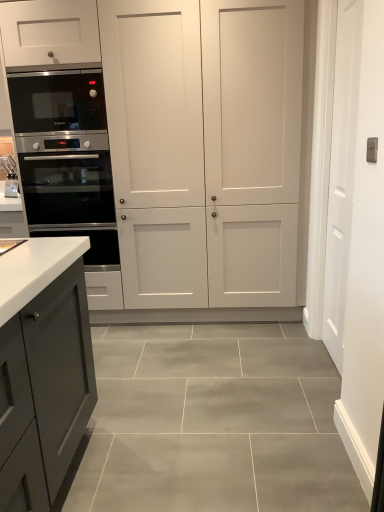
Question: From a real-world perspective, is white matte cabinet at center positioned over white glossy sink at left based on gravity?

Choices:
 (A) no
 (B) yes

Answer: (B)

Question: Is white matte cabinet at center taller than white glossy sink at left?

Choices:
 (A) no
 (B) yes

Answer: (B)

Question: Considering the relative sizes of white matte cabinet at center and white glossy sink at left in the image provided, is white matte cabinet at center shorter than white glossy sink at left?

Choices:
 (A) no
 (B) yes

Answer: (A)

Question: Can you confirm if white matte cabinet at center is thinner than white glossy sink at left?

Choices:
 (A) yes
 (B) no

Answer: (B)

Question: From a real-world perspective, is white matte cabinet at center beneath white glossy sink at left?

Choices:
 (A) no
 (B) yes

Answer: (A)

Question: Considering the positions of stainless steel oven at left and white glossy sink at left in the image, is stainless steel oven at left taller or shorter than white glossy sink at left?

Choices:
 (A) tall
 (B) short

Answer: (A)

Question: From a real-world perspective, is stainless steel oven at left positioned above or below white glossy sink at left?

Choices:
 (A) below
 (B) above

Answer: (A)

Question: Is stainless steel oven at left situated inside white glossy sink at left or outside?

Choices:
 (A) outside
 (B) inside

Answer: (A)

Question: Is stainless steel oven at left wider or thinner than white glossy sink at left?

Choices:
 (A) wide
 (B) thin

Answer: (A)

Question: Is white glossy sink at left in front of or behind stainless steel oven at left in the image?

Choices:
 (A) front
 (B) behind

Answer: (B)

Question: Choose the correct answer: Is white glossy sink at left inside stainless steel oven at left or outside it?

Choices:
 (A) outside
 (B) inside

Answer: (A)

Question: From a real-world perspective, is white glossy sink at left positioned above or below stainless steel oven at left?

Choices:
 (A) below
 (B) above

Answer: (B)

Question: From their relative heights in the image, would you say white glossy sink at left is taller or shorter than stainless steel oven at left?

Choices:
 (A) short
 (B) tall

Answer: (A)

Question: Considering the positions of black stainless steel microwave at left and white glossy sink at left in the image, is black stainless steel microwave at left taller or shorter than white glossy sink at left?

Choices:
 (A) tall
 (B) short

Answer: (A)

Question: Is black stainless steel microwave at left inside or outside of white glossy sink at left?

Choices:
 (A) outside
 (B) inside

Answer: (A)